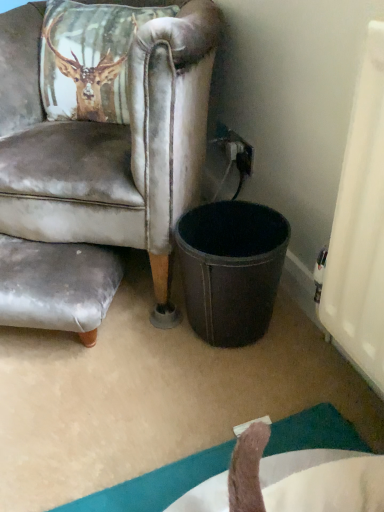
Question: Is black plastic power outlet at upper right facing towards leather at right?

Choices:
 (A) yes
 (B) no

Answer: (A)

Question: Considering the relative sizes of black plastic power outlet at upper right and leather at right in the image provided, is black plastic power outlet at upper right smaller than leather at right?

Choices:
 (A) no
 (B) yes

Answer: (B)

Question: From the image's perspective, is black plastic power outlet at upper right located above leather at right?

Choices:
 (A) yes
 (B) no

Answer: (B)

Question: Does black plastic power outlet at upper right contain leather at right?

Choices:
 (A) yes
 (B) no

Answer: (B)

Question: Does black plastic power outlet at upper right appear on the right side of leather at right?

Choices:
 (A) no
 (B) yes

Answer: (B)

Question: From the image's perspective, is black plastic power outlet at upper right below leather at right?

Choices:
 (A) yes
 (B) no

Answer: (A)

Question: Is black plastic power outlet at upper right bigger than gray fabric swivel chair at lower left?

Choices:
 (A) yes
 (B) no

Answer: (B)

Question: Would you say black plastic power outlet at upper right is a long distance from gray fabric swivel chair at lower left?

Choices:
 (A) yes
 (B) no

Answer: (B)

Question: From the image's perspective, is black plastic power outlet at upper right located beneath gray fabric swivel chair at lower left?

Choices:
 (A) no
 (B) yes

Answer: (A)

Question: Can gray fabric swivel chair at lower left be found inside black plastic power outlet at upper right?

Choices:
 (A) no
 (B) yes

Answer: (A)

Question: From a real-world perspective, does black plastic power outlet at upper right stand above gray fabric swivel chair at lower left?

Choices:
 (A) yes
 (B) no

Answer: (A)

Question: Is black plastic power outlet at upper right at the left side of gray fabric swivel chair at lower left?

Choices:
 (A) no
 (B) yes

Answer: (A)

Question: Does leather at right have a lesser width compared to gray fabric swivel chair at lower left?

Choices:
 (A) no
 (B) yes

Answer: (A)